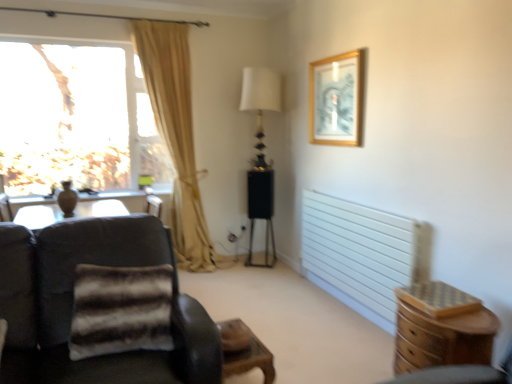
Question: Is beige fabric curtain at left at the back of fuzzy fur pillow at lower left?

Choices:
 (A) no
 (B) yes

Answer: (B)

Question: Is fuzzy fur pillow at lower left smaller than beige fabric curtain at left?

Choices:
 (A) no
 (B) yes

Answer: (B)

Question: Would you say fuzzy fur pillow at lower left is a long distance from beige fabric curtain at left?

Choices:
 (A) no
 (B) yes

Answer: (B)

Question: Is fuzzy fur pillow at lower left outside of beige fabric curtain at left?

Choices:
 (A) no
 (B) yes

Answer: (B)

Question: From the image's perspective, would you say fuzzy fur pillow at lower left is positioned over beige fabric curtain at left?

Choices:
 (A) no
 (B) yes

Answer: (A)

Question: From a real-world perspective, is fuzzy fur pillow at lower left positioned over beige fabric curtain at left based on gravity?

Choices:
 (A) no
 (B) yes

Answer: (A)

Question: Is white glossy table lamp at center in front of gold-framed picture at upper right?

Choices:
 (A) yes
 (B) no

Answer: (B)

Question: Is white glossy table lamp at center with gold-framed picture at upper right?

Choices:
 (A) yes
 (B) no

Answer: (B)

Question: Does white glossy table lamp at center have a larger size compared to gold-framed picture at upper right?

Choices:
 (A) yes
 (B) no

Answer: (A)

Question: Considering the relative sizes of white glossy table lamp at center and gold-framed picture at upper right in the image provided, is white glossy table lamp at center smaller than gold-framed picture at upper right?

Choices:
 (A) no
 (B) yes

Answer: (A)

Question: Is gold-framed picture at upper right a part of white glossy table lamp at center?

Choices:
 (A) no
 (B) yes

Answer: (A)

Question: Can you confirm if white glossy table lamp at center is positioned to the left of gold-framed picture at upper right?

Choices:
 (A) no
 (B) yes

Answer: (B)

Question: From a real-world perspective, is wooden chest of drawers at lower right physically above white glossy table lamp at center?

Choices:
 (A) yes
 (B) no

Answer: (B)